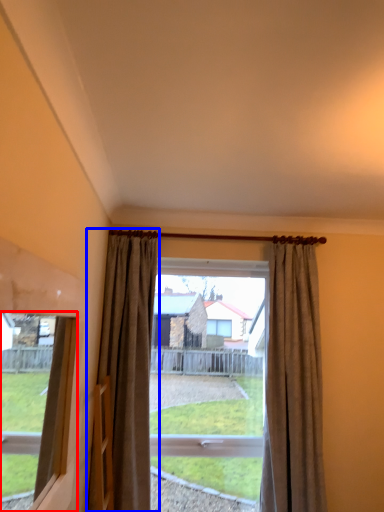
Question: Which point is closer to the camera, window (highlighted by a red box) or curtain (highlighted by a blue box)?

Choices:
 (A) window
 (B) curtain

Answer: (A)